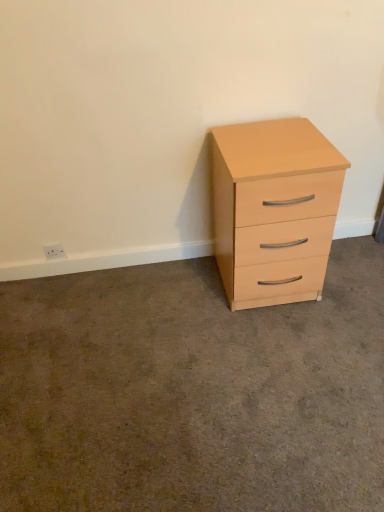
This screenshot has height=512, width=384. In order to click on vacant space in front of matte wood chest of drawers at right in this screenshot , I will do `click(279, 347)`.